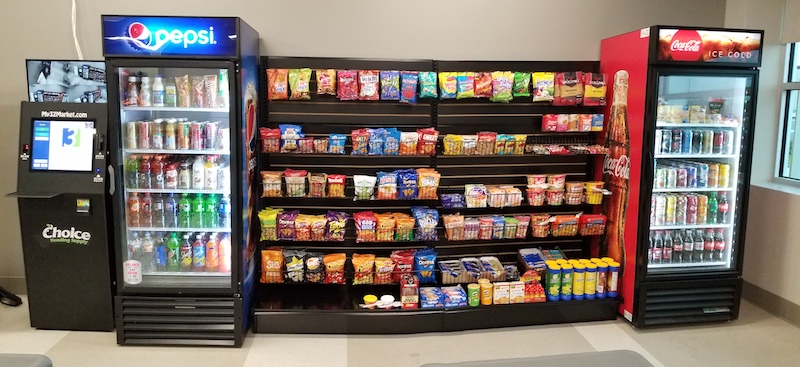
Find the location of a particular element. Image resolution: width=800 pixels, height=367 pixels. floor is located at coordinates (440, 355), (697, 343), (161, 357).